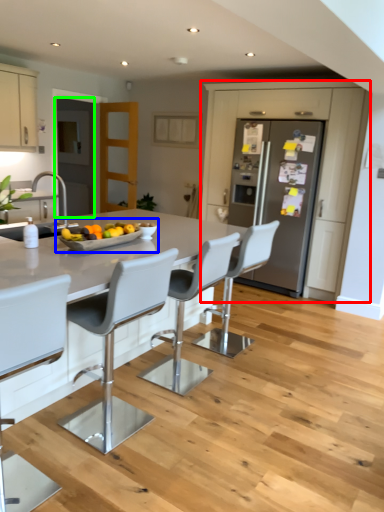
Question: Based on their relative distances, which object is farther from cabinetry (highlighted by a red box)? Choose from fruit dish (highlighted by a blue box) and glass door (highlighted by a green box).

Choices:
 (A) fruit dish
 (B) glass door

Answer: (A)